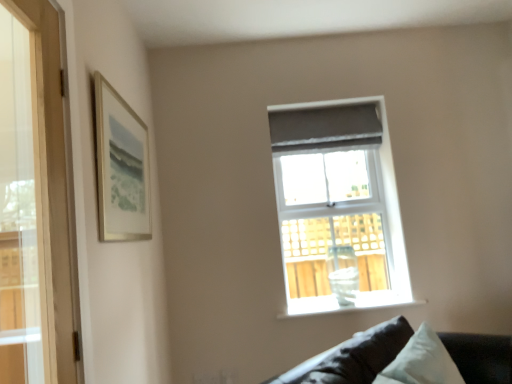
Question: From the image's perspective, would you say dark gray fabric couch at lower right is shown under matte silver picture frame at upper left?

Choices:
 (A) yes
 (B) no

Answer: (A)

Question: Is dark gray fabric couch at lower right at the right side of matte silver picture frame at upper left?

Choices:
 (A) no
 (B) yes

Answer: (B)

Question: Is dark gray fabric couch at lower right turned away from matte silver picture frame at upper left?

Choices:
 (A) yes
 (B) no

Answer: (B)

Question: Is dark gray fabric couch at lower right wider than matte silver picture frame at upper left?

Choices:
 (A) yes
 (B) no

Answer: (A)

Question: Is dark gray fabric couch at lower right positioned behind matte silver picture frame at upper left?

Choices:
 (A) no
 (B) yes

Answer: (A)

Question: Is matte gray curtain at upper center wider or thinner than matte gray window at upper center?

Choices:
 (A) thin
 (B) wide

Answer: (A)

Question: Is matte gray curtain at upper center spatially inside matte gray window at upper center, or outside of it?

Choices:
 (A) outside
 (B) inside

Answer: (B)

Question: Considering their positions, is matte gray curtain at upper center located in front of or behind matte gray window at upper center?

Choices:
 (A) behind
 (B) front

Answer: (A)

Question: Is matte gray curtain at upper center to the left or to the right of matte gray window at upper center in the image?

Choices:
 (A) right
 (B) left

Answer: (B)

Question: Considering the positions of point (x=294, y=302) and point (x=375, y=228), is point (x=294, y=302) closer or farther from the camera than point (x=375, y=228)?

Choices:
 (A) farther
 (B) closer

Answer: (B)

Question: Is white glossy vase at center situated inside matte gray window at upper center or outside?

Choices:
 (A) inside
 (B) outside

Answer: (A)

Question: Relative to matte gray window at upper center, is white glossy vase at center in front or behind?

Choices:
 (A) behind
 (B) front

Answer: (B)

Question: Considering the positions of white glossy vase at center and matte gray window at upper center in the image, is white glossy vase at center wider or thinner than matte gray window at upper center?

Choices:
 (A) wide
 (B) thin

Answer: (B)

Question: Does point (134, 192) appear closer or farther from the camera than point (388, 281)?

Choices:
 (A) farther
 (B) closer

Answer: (B)

Question: Choose the correct answer: Is matte silver picture frame at upper left inside matte gray window at upper center or outside it?

Choices:
 (A) outside
 (B) inside

Answer: (A)